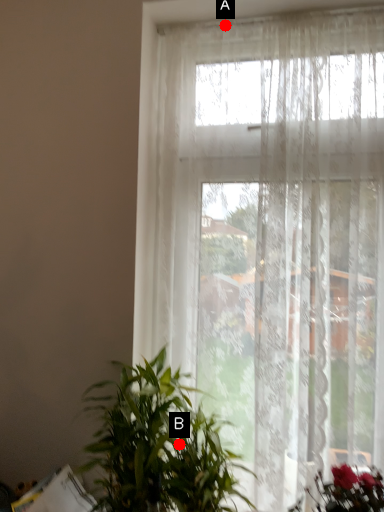
Question: Two points are circled on the image, labeled by A and B beside each circle. Among these points, which one is farthest from the camera?

Choices:
 (A) A is further
 (B) B is further

Answer: (A)